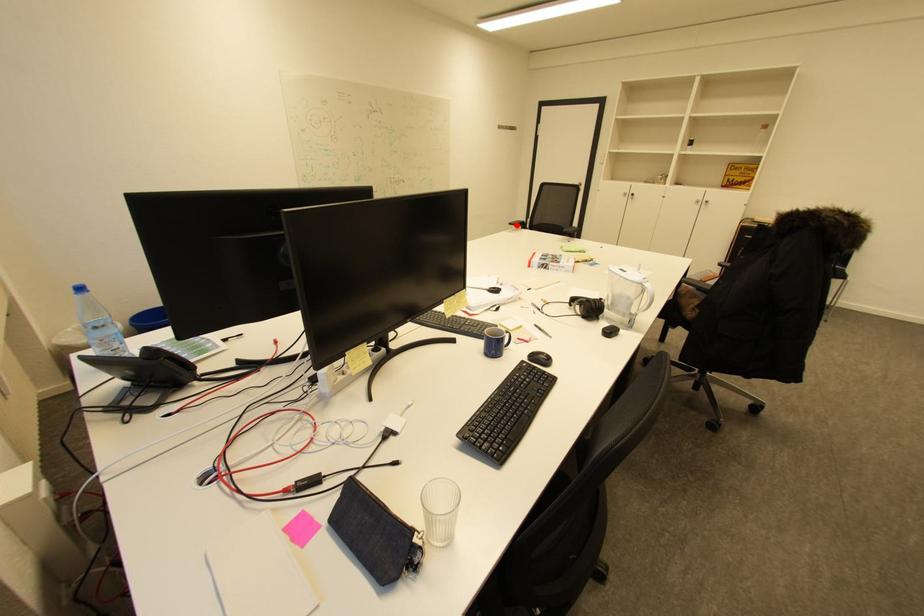
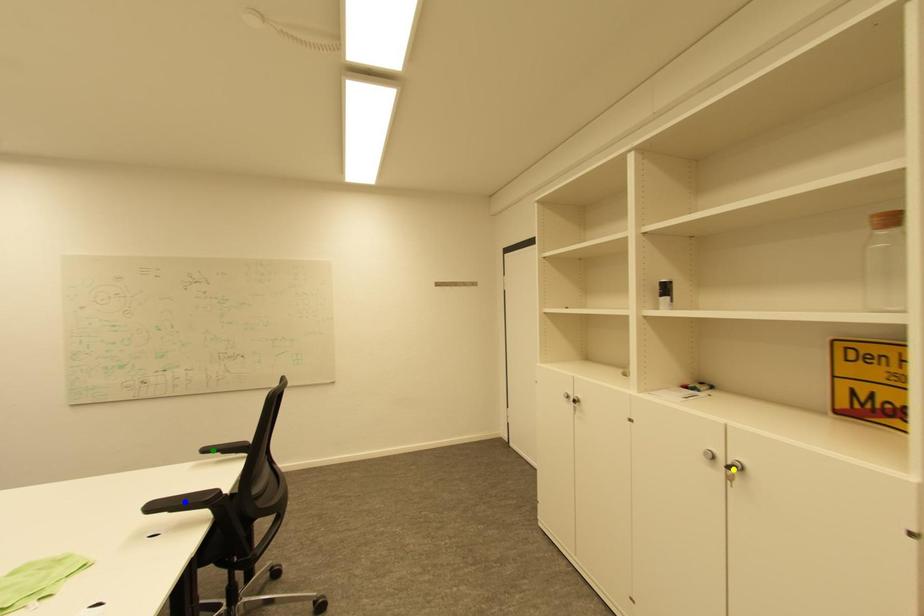
Question: I am providing you with two images of the same scene from different viewpoints. A red point is marked on the first image. You are given multiple points on the second image. Which point in image 2 is actually the same real-world point as the red point in image 1?

Choices:
 (A) blue point
 (B) green point
 (C) yellow point

Answer: (B)